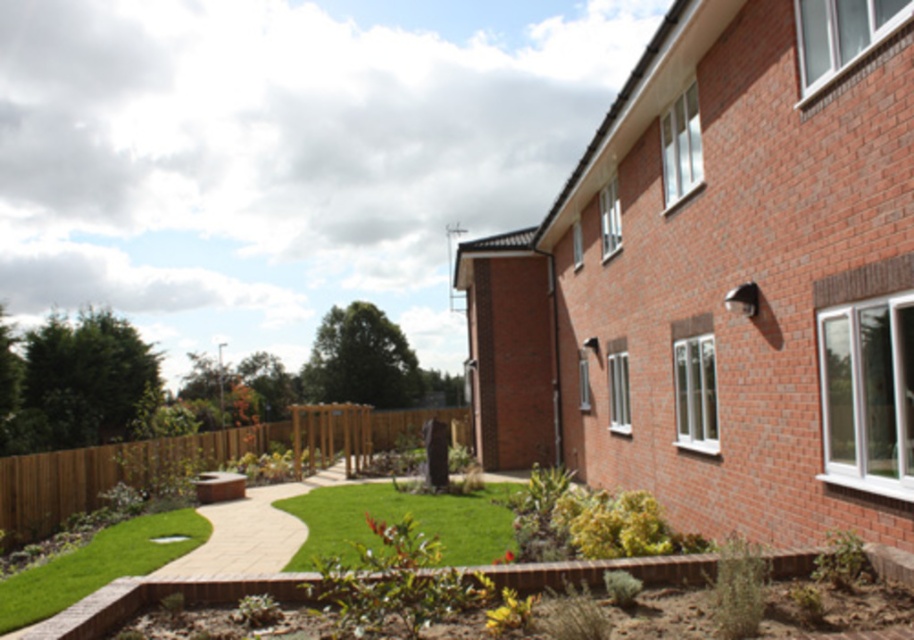
Question: Is brown wooden fence at lower center bigger than green lawn at center?

Choices:
 (A) yes
 (B) no

Answer: (A)

Question: Among these points, which one is nearest to the camera?

Choices:
 (A) [349, 545]
 (B) [91, 541]

Answer: (A)

Question: Which point is closer to the camera?

Choices:
 (A) green lawn at center
 (B) brown wooden fence at lower center

Answer: (A)

Question: Based on their relative distances, which object is farther from the green lawn at center?

Choices:
 (A) brown wooden fence at lower center
 (B) green artificial turf at lower left

Answer: (A)

Question: Does brown wooden fence at lower center have a lesser width compared to green lawn at center?

Choices:
 (A) no
 (B) yes

Answer: (A)

Question: Does brown wooden fence at lower center appear on the left side of green lawn at center?

Choices:
 (A) yes
 (B) no

Answer: (A)